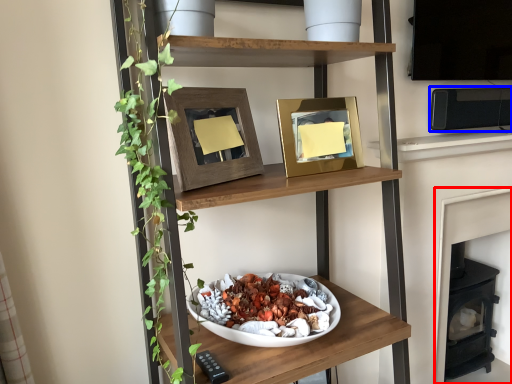
Question: Among these objects, which one is farthest to the camera, fireplace (highlighted by a red box) or appliance (highlighted by a blue box)?

Choices:
 (A) fireplace
 (B) appliance

Answer: (A)